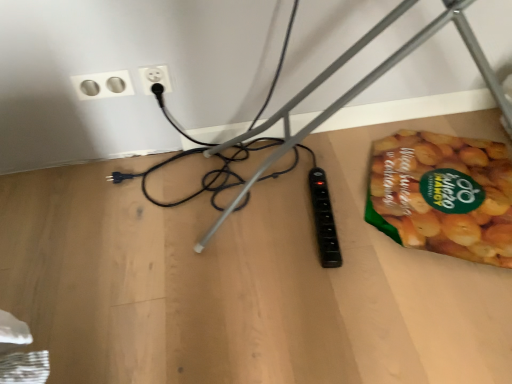
At what (x,y) coordinates should I click in order to perform the action: click on vacant point above wooden table at lower right (from a real-world perspective). Please return your answer as a coordinate pair (x, y). Looking at the image, I should click on (284, 242).